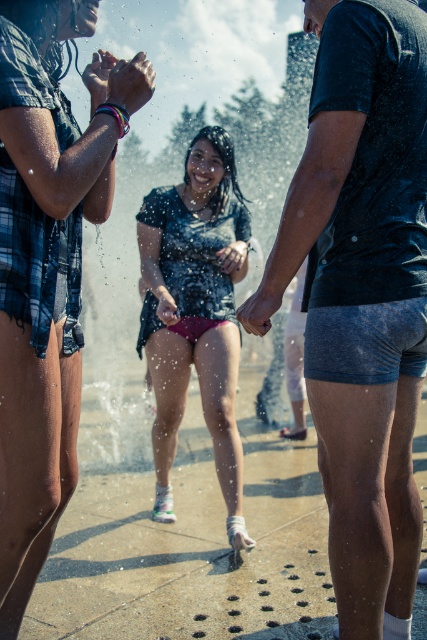
You are designing a new clothing line and want to ensure that the dark blue textured shorts at center and the matte pink shorts at center can be worn together in a coordinated outfit. Based on their widths, which pair of shorts would you recommend as the main focus for the collection to maintain visual balance?

The dark blue textured shorts at center might be wider than matte pink shorts at center, so to maintain visual balance in the coordinated outfit, the wider dark blue textured shorts at center could be the main focus while pairing them with the narrower matte pink shorts at center as an accent piece.

You are a fashion designer observing the central figures in the fountain scene. Which of the following items is positioned higher on the person wearing dark blue textured shorts at center compared to the matte pink shorts at center?

The dark blue textured shorts at center is positioned above the matte pink shorts at center.